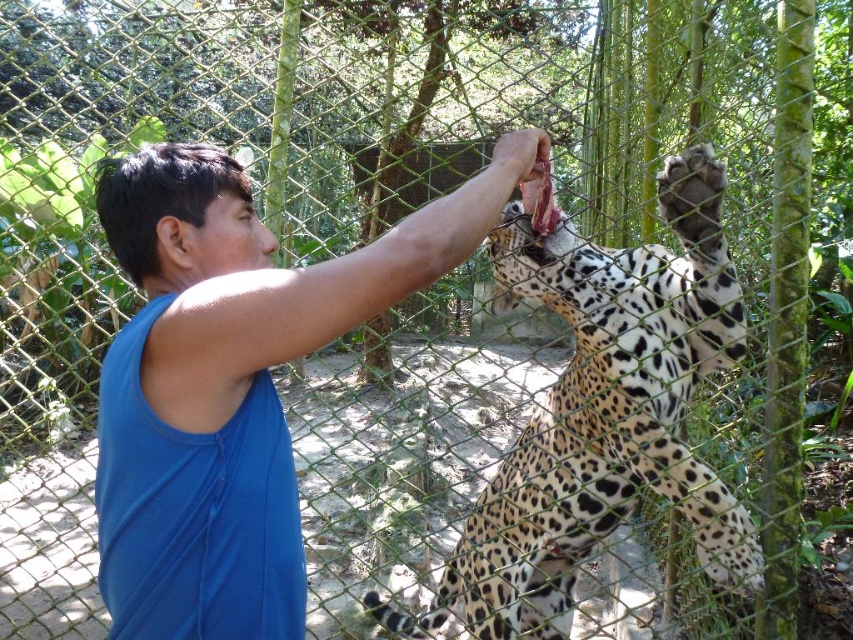
You are a zookeeper observing the interaction between the blue fabric shirt at center and the spotted fur leopard at center. Which object takes up more area in the image?

The spotted fur leopard at center occupies more space than the blue fabric shirt at center, so the leopard takes up more area in the image.

You are a zookeeper observing the interaction between the blue fabric shirt at center and the spotted fur leopard at center. Based on their positions, which one is closer to the fence?

The blue fabric shirt at center is closer to the fence because it is in front of the spotted fur leopard at center.

You are a zookeeper observing the feeding interaction between the blue fabric shirt at center and the spotted fur leopard at center. Based on their positions, can you determine which one is higher in elevation?

The blue fabric shirt at center is above spotted fur leopard at center, so the blue fabric shirt at center is higher in elevation.